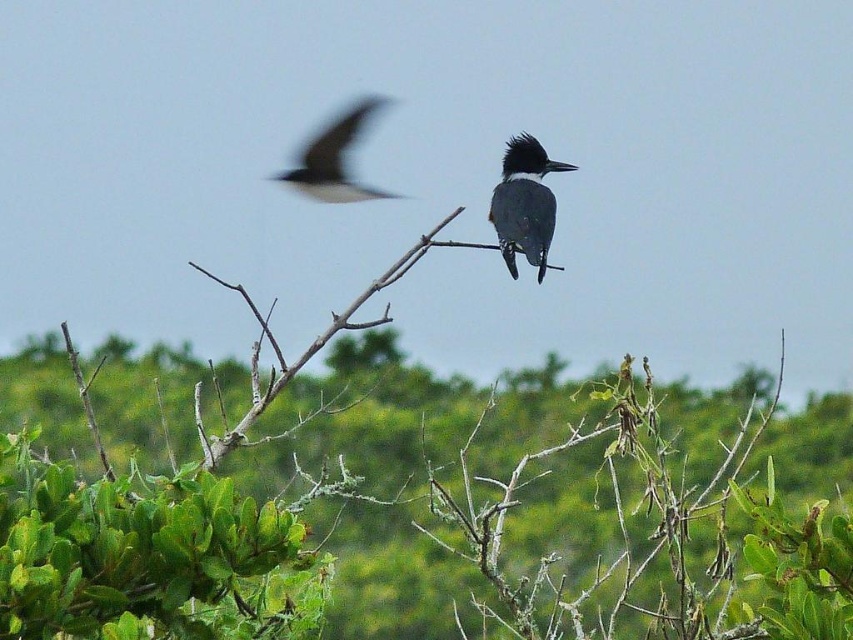
Does green leafy tree at center have a greater height compared to dark gray feathers at upper left?

Indeed, green leafy tree at center has a greater height compared to dark gray feathers at upper left.

Is green leafy tree at center to the left of dark gray feathers at upper left from the viewer's perspective?

In fact, green leafy tree at center is to the right of dark gray feathers at upper left.

Between point (755, 560) and point (300, 168), which one is positioned behind?

Positioned behind is point (300, 168).

This screenshot has width=853, height=640. Identify the location of green leafy tree at center. (151, 552).

Can you confirm if brown rough branch at center is positioned below dark gray feathers at upper left?

Yes.

Is brown rough branch at center to the left of dark gray feathers at upper left from the viewer's perspective?

Correct, you'll find brown rough branch at center to the left of dark gray feathers at upper left.

Describe the element at coordinates (305, 348) in the screenshot. I see `brown rough branch at center` at that location.

You are a GUI agent. You are given a task and a screenshot of the screen. Output one action in this format:
    pyautogui.click(x=<x>, y=<y>)
    Task: Click on the brown rough branch at center
    The image size is (853, 640).
    Given the screenshot: What is the action you would take?
    pyautogui.click(x=305, y=348)

Image resolution: width=853 pixels, height=640 pixels. What do you see at coordinates (151, 552) in the screenshot?
I see `green leafy tree at center` at bounding box center [151, 552].

Can you confirm if green leafy tree at center is smaller than gray glossy bird at center?

Actually, green leafy tree at center might be larger than gray glossy bird at center.

The height and width of the screenshot is (640, 853). I want to click on green leafy tree at center, so click(x=151, y=552).